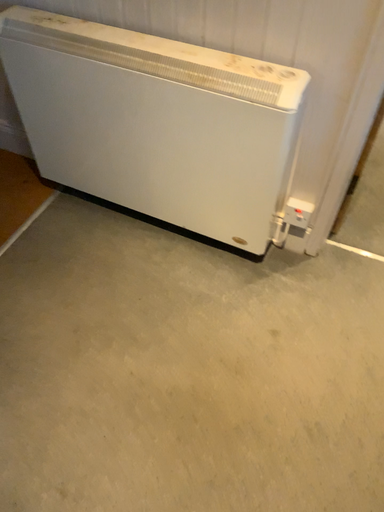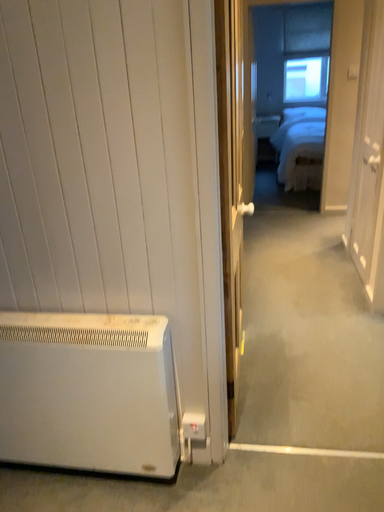
Question: How did the camera likely rotate when shooting the video?

Choices:
 (A) rotated upward
 (B) rotated downward

Answer: (A)